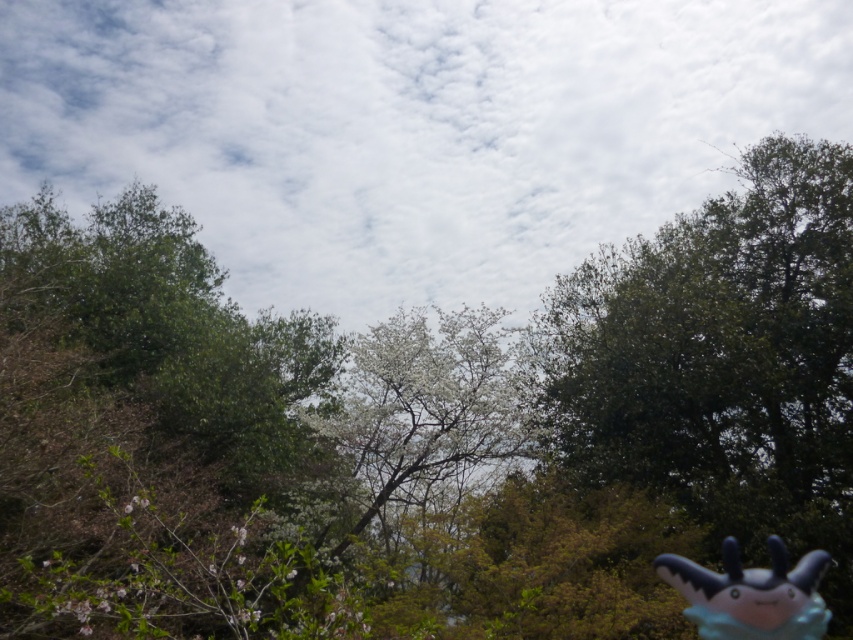
In the scene shown: You are a photographer standing in the outdoor scene. You want to take a photo of the blue plush toy at lower right without the white blossoming tree at center blocking it. Is this possible?

The blue plush toy at lower right is behind the white blossoming tree at center, so it cannot be photographed without the tree blocking it unless you move the toy or the tree.

You are standing at the point marked as point (427, 410). What object is exactly at your current location?

The white blossoming tree at center is located at point (427, 410).

You are a photographer planning to capture the green leafy tree at upper left and the blue plush toy at lower right in a single frame. Given their sizes, which object will appear larger in the photo?

The green leafy tree at upper left will appear larger in the photo because it is much taller than the blue plush toy at lower right.